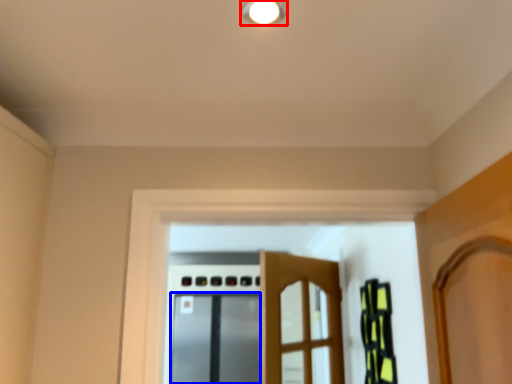
Question: Which of the following is the closest to the observer, light fixture (highlighted by a red box) or screen door (highlighted by a blue box)?

Choices:
 (A) light fixture
 (B) screen door

Answer: (A)